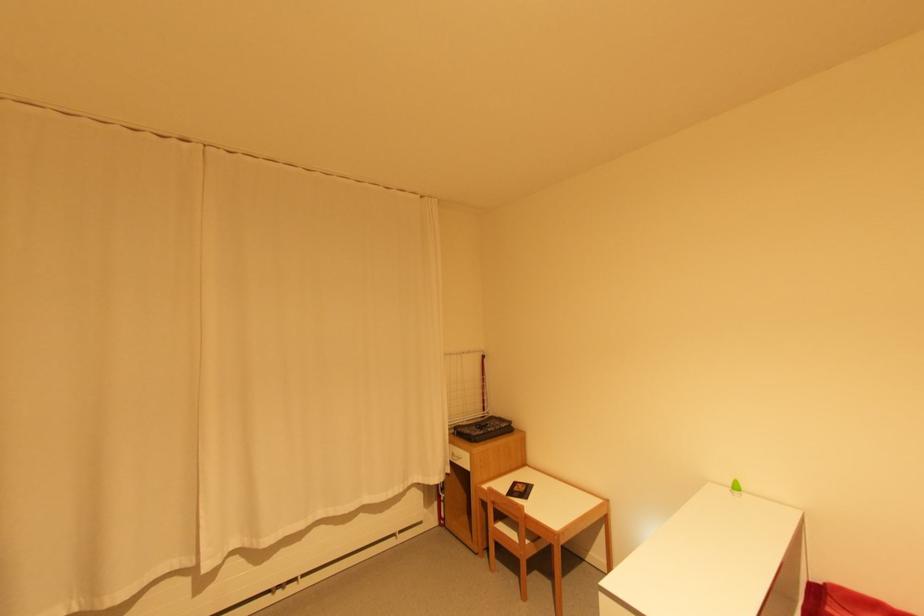
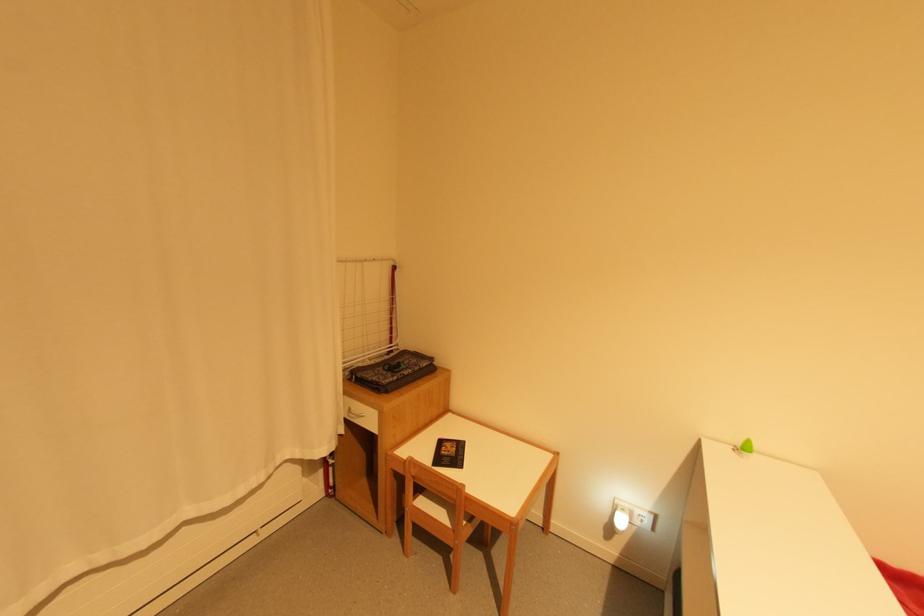
Find the pixel in the second image that matches point (503, 428) in the first image.

(421, 369)